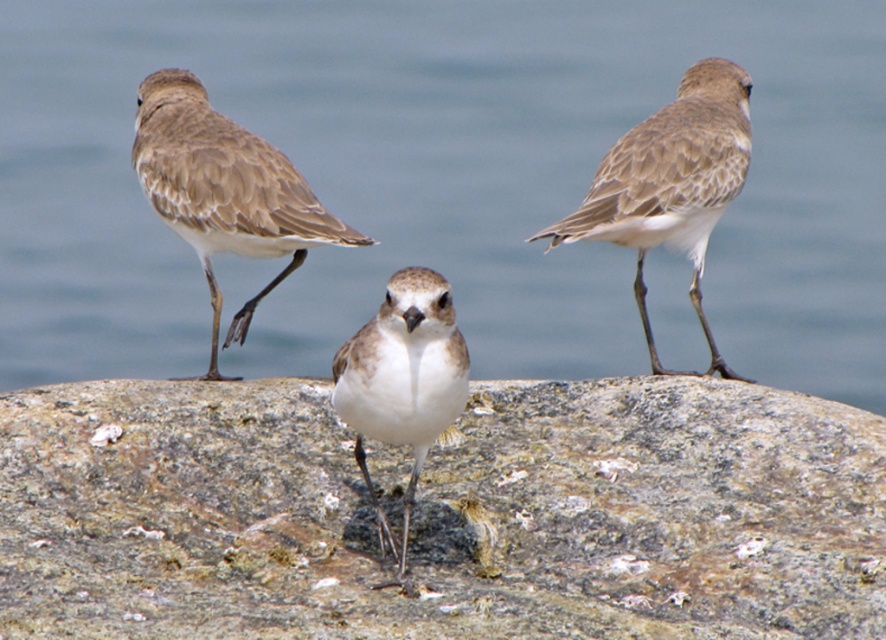
Is point (193, 93) farther from camera compared to point (364, 419)?

Yes, it is.

Which is in front, point (271, 209) or point (399, 352)?

Point (399, 352) is in front.

This screenshot has height=640, width=886. I want to click on brown speckled feathers at left, so click(223, 189).

Which is below, brown speckled feathers at left or brown speckled feathers at upper right?

brown speckled feathers at left

From the picture: How far apart are brown speckled feathers at left and brown speckled feathers at upper right?

The distance of brown speckled feathers at left from brown speckled feathers at upper right is 31.86 inches.

Does point (254, 140) come in front of point (655, 134)?

Yes, point (254, 140) is closer to viewer.

You are a GUI agent. You are given a task and a screenshot of the screen. Output one action in this format:
    pyautogui.click(x=<x>, y=<y>)
    Task: Click on the brown speckled feathers at left
    This screenshot has height=640, width=886.
    Given the screenshot: What is the action you would take?
    pyautogui.click(x=223, y=189)

Is blue water at center to the left of white matte bird at center from the viewer's perspective?

Correct, you'll find blue water at center to the left of white matte bird at center.

Image resolution: width=886 pixels, height=640 pixels. What do you see at coordinates (443, 180) in the screenshot?
I see `blue water at center` at bounding box center [443, 180].

Identify the location of blue water at center. The height and width of the screenshot is (640, 886). (443, 180).